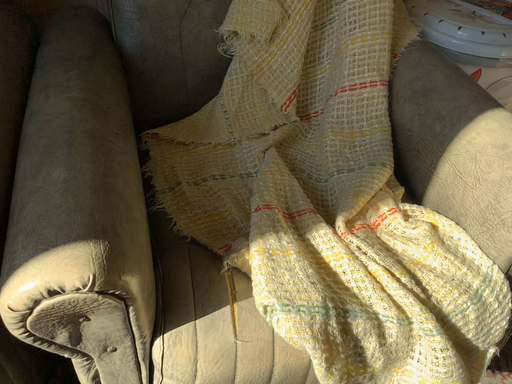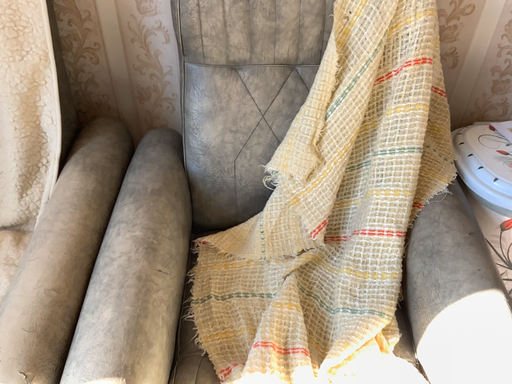
Question: Which way did the camera rotate in the video?

Choices:
 (A) rotated right
 (B) rotated left

Answer: (B)